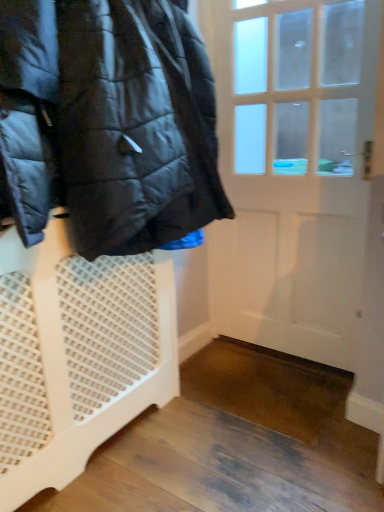
At what (x,y) coordinates should I click in order to perform the action: click on spots to the right of white mesh laundry basket at left. Please return your answer as a coordinate pair (x, y). The image size is (384, 512). Looking at the image, I should click on (232, 432).